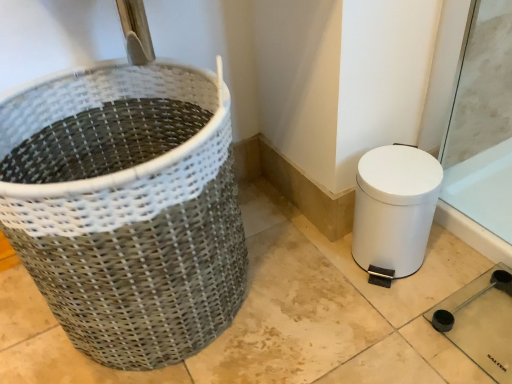
Locate an element on the screen. free space to the right of natural woven basket at left is located at coordinates click(315, 293).